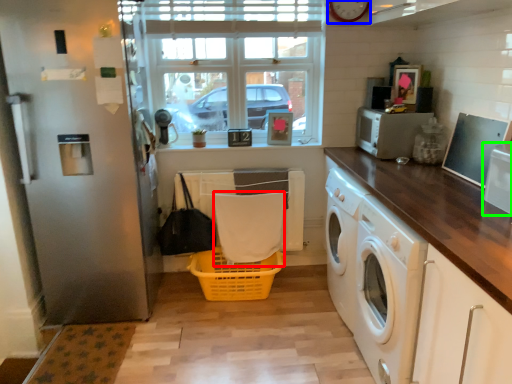
Question: Based on their relative distances, which object is nearer to material (highlighted by a red box)? Choose from clock (highlighted by a blue box) and appliance (highlighted by a green box).

Choices:
 (A) clock
 (B) appliance

Answer: (A)